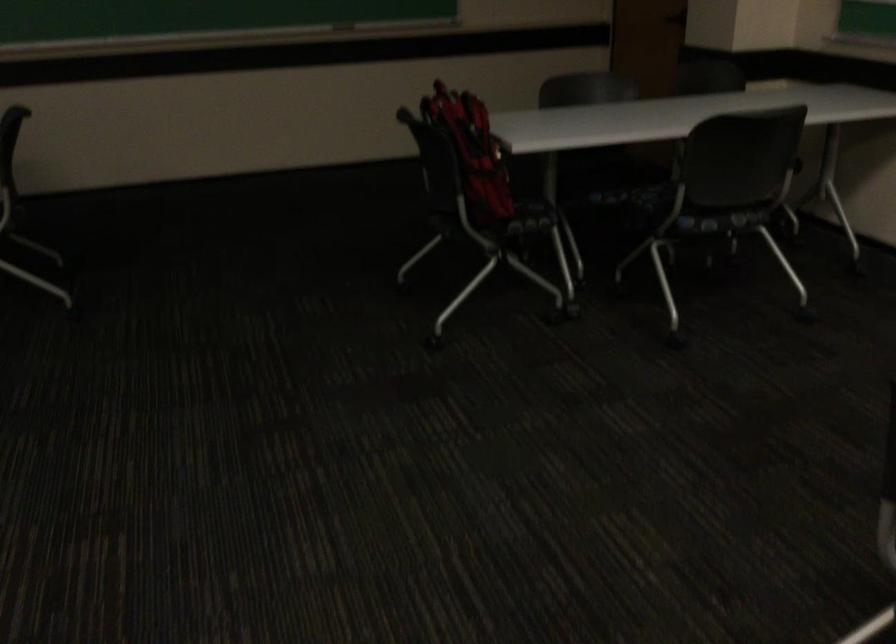
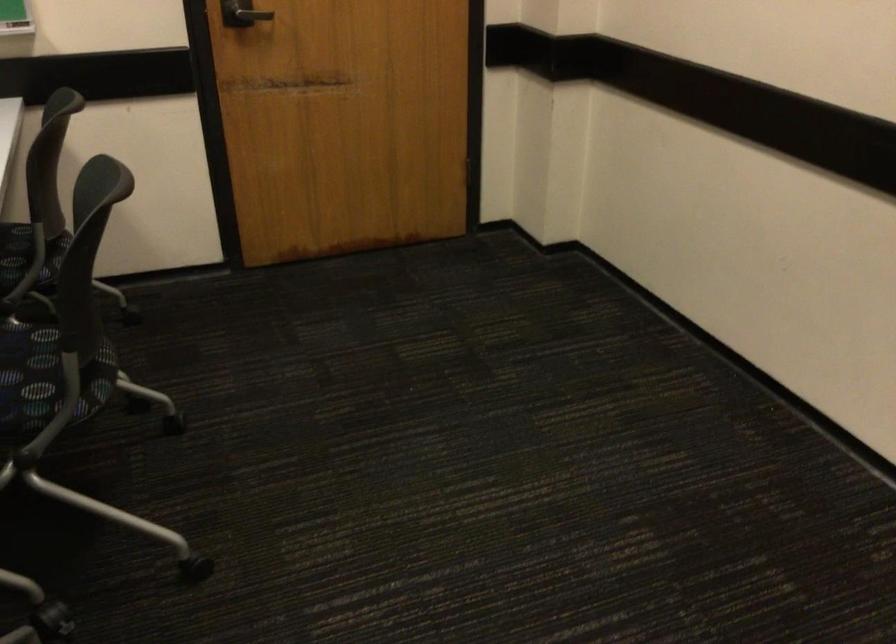
From the picture: First-person continuous shooting, in which direction is the camera rotating?

The camera's rotation is toward right-down.